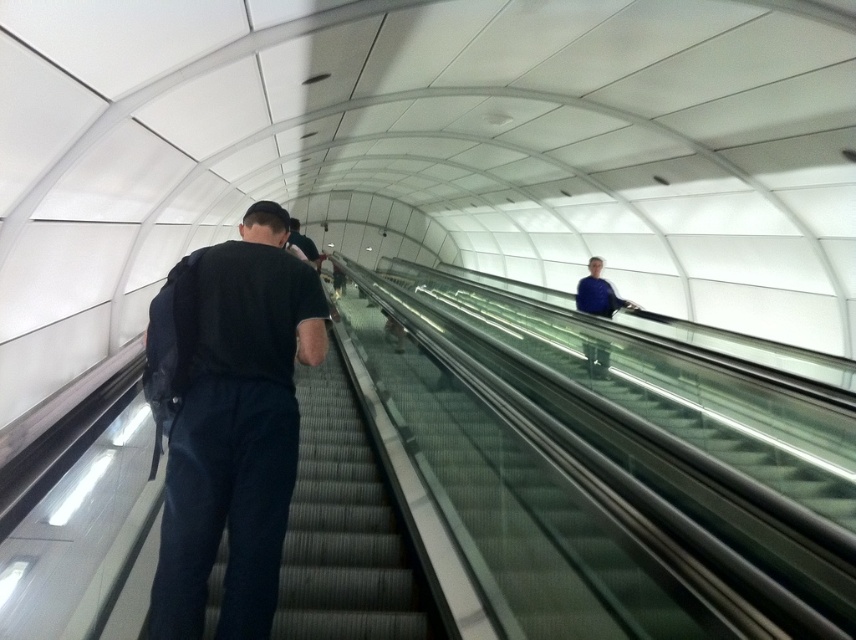
Looking at this image, you are a security guard in the tunnel. You see the black fabric backpack at left and the black fabric stairs at center. Which object is closer to the camera?

The black fabric backpack at left is closer to the camera because it is positioned over the black fabric stairs at center.

You are standing at the entrance of the tunnel and see the black fabric stairs at center and the blue fabric jacket at upper center. Which object is closer to you?

The black fabric stairs at center is closer to you because it is only 4.81 meters away from the blue fabric jacket at upper center, which is further away.

You are standing at the entrance of the tunnel and want to reach the blue fabric jacket at upper center without getting too close to the black fabric backpack at left. Is the distance between them sufficient for you to walk around the backpack while maintaining a safe distance?

The black fabric backpack at left is 22.10 feet away from the blue fabric jacket at upper center. Since the distance is quite large, you can easily walk around the backpack while maintaining a safe distance.